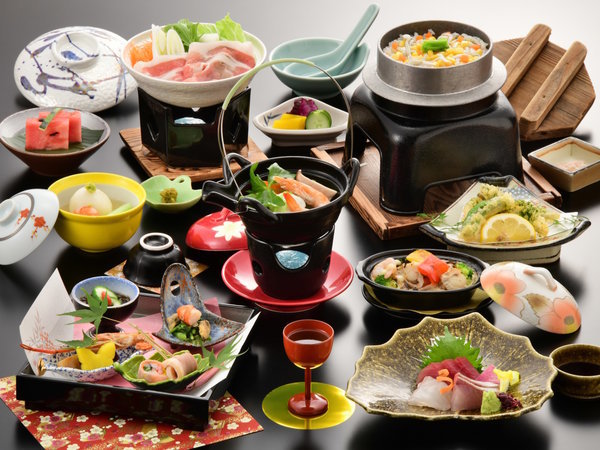
Find the location of a particular element. Image resolution: width=600 pixels, height=450 pixels. bowl is located at coordinates (585, 377), (443, 276), (462, 53), (195, 77), (120, 220), (90, 146).